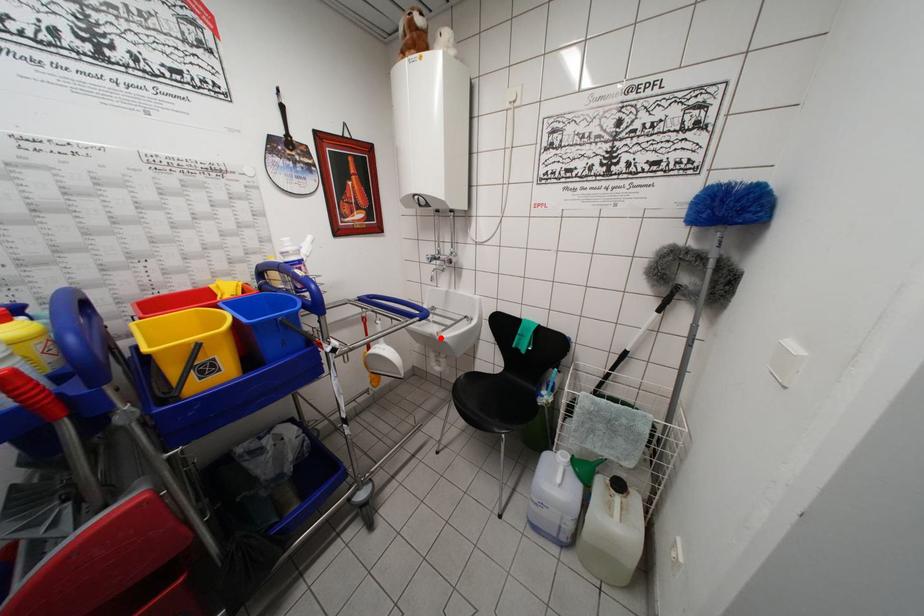
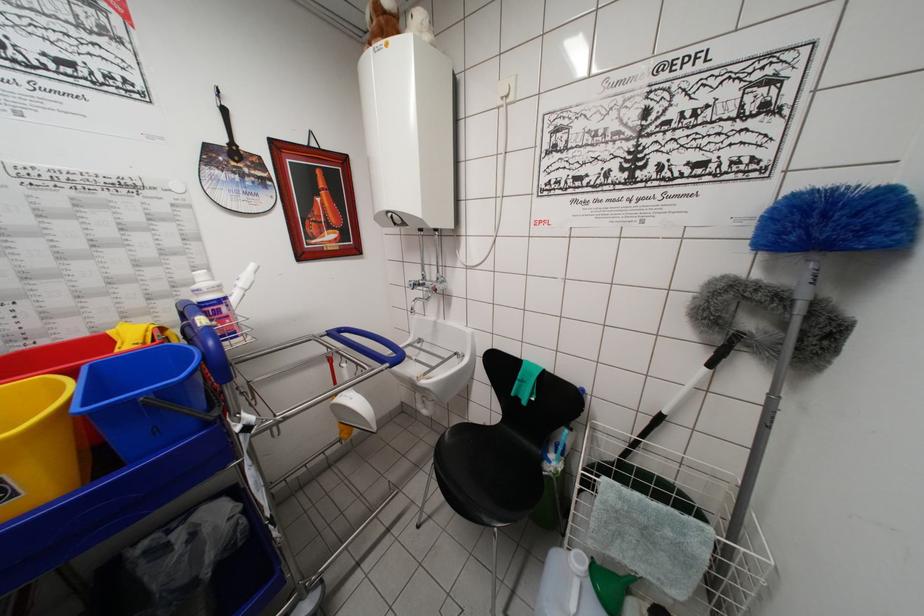
Where in the second image is the point corresponding to the highlighted location from the first image?

(420, 383)